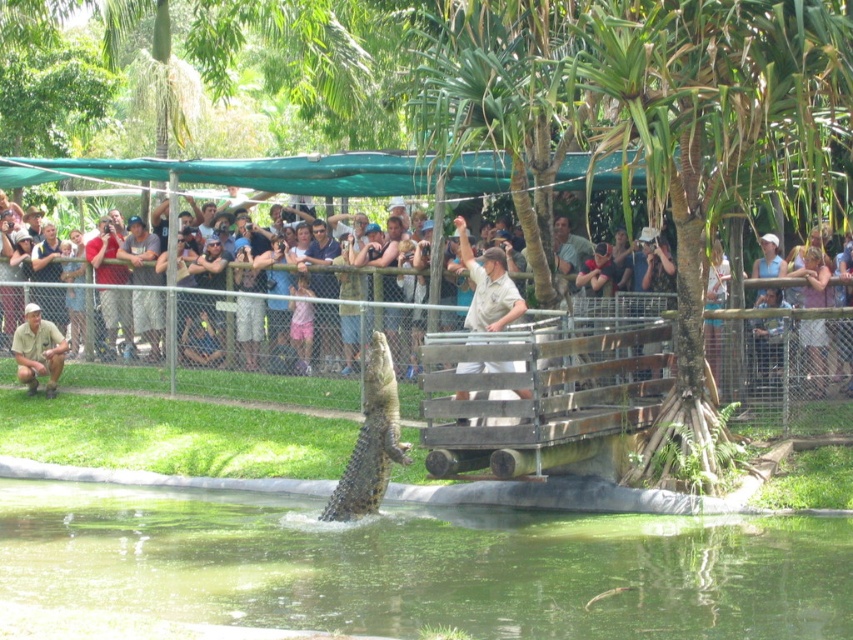
You are a visitor at the wildlife park and want to take a photo of the greenish water at center without the matte green fence at center blocking the view. Is this possible?

The greenish water at center is not as tall as the matte green fence at center, so the fence is taller than the water. Therefore, you can take a photo of the greenish water at center without the matte green fence at center blocking the view by positioning yourself lower or angling the camera to avoid the fence.

You are a zookeeper who needs to feed the leathery brown crocodile at center from the matte green fence at center. Can you safely reach the crocodile with a 5 meter long feeding pole?

The distance between the matte green fence at center and the leathery brown crocodile at center is 5.24 meters. Since the feeding pole is only 5 meters long, it is 24 centimeters too short to safely reach the crocodile.